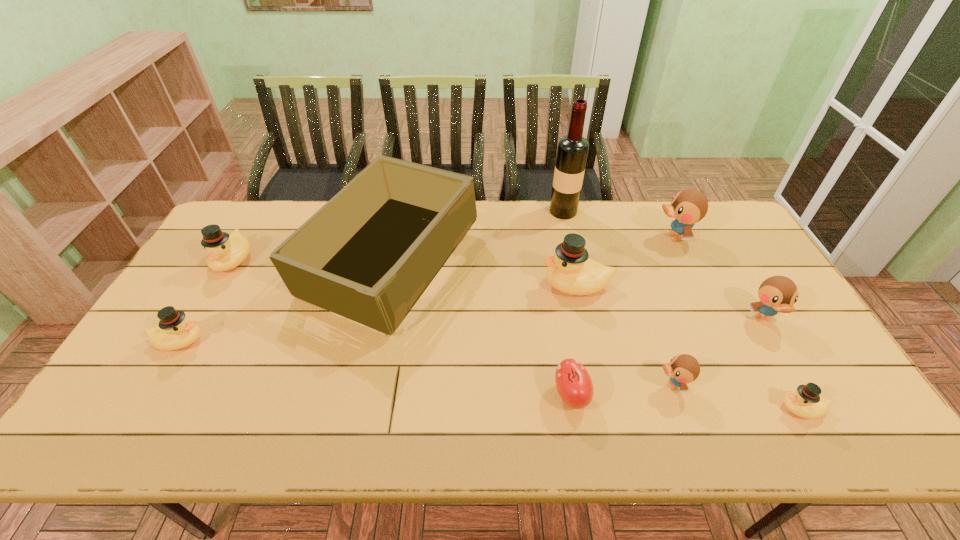
Locate an element on the screen. The height and width of the screenshot is (540, 960). vacant space located on the front-facing side of the farthest blue duck is located at coordinates (626, 237).

Where is `vacant region located on the front-facing side of the fifth duck from right to left`? Image resolution: width=960 pixels, height=540 pixels. vacant region located on the front-facing side of the fifth duck from right to left is located at coordinates (444, 285).

This screenshot has width=960, height=540. I want to click on vacant space located 0.370m on the front-facing side of the fifth duck from right to left, so pyautogui.click(x=419, y=285).

The width and height of the screenshot is (960, 540). In order to click on vacant space located 0.240m on the front-facing side of the fifth duck from right to left in this screenshot , I will do `click(462, 285)`.

Identify the location of vacant space located on the front-facing side of the second biggest yellow duck. The height and width of the screenshot is (540, 960). (204, 309).

Identify the location of free space located on the front-facing side of the second smallest blue duck. (833, 439).

Find the location of `vacant space located 0.130m on the front-facing side of the third biggest yellow duck`. vacant space located 0.130m on the front-facing side of the third biggest yellow duck is located at coordinates (254, 341).

This screenshot has width=960, height=540. In order to click on free location located 0.220m on the right of the apple in this screenshot , I will do `click(681, 396)`.

The height and width of the screenshot is (540, 960). In order to click on free point located on the front-facing side of the leftmost blue duck in this screenshot , I will do `click(504, 385)`.

Locate an element on the screen. This screenshot has width=960, height=540. vacant space situated 0.190m on the front-facing side of the leftmost blue duck is located at coordinates (578, 385).